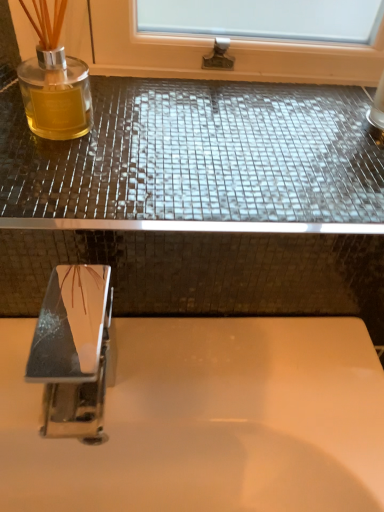
Locate an element on the screen. The image size is (384, 512). polished chrome tap at lower left is located at coordinates (73, 351).

This screenshot has height=512, width=384. What are the coordinates of `shiny mosaic tile counter top at upper center` in the screenshot? It's located at (199, 161).

At what (x,y) coordinates should I click in order to perform the action: click on white glossy sink at center. Please return your answer as a coordinate pair (x, y). The image size is (384, 512). Looking at the image, I should click on (187, 410).

Identify the location of polished chrome tap at lower left. Image resolution: width=384 pixels, height=512 pixels. (73, 351).

Which object is closer to the camera taking this photo, white glossy sink at center or polished chrome tap at lower left?

Positioned in front is polished chrome tap at lower left.

Can you confirm if white glossy sink at center is smaller than polished chrome tap at lower left?

No, white glossy sink at center is not smaller than polished chrome tap at lower left.

From a real-world perspective, is white glossy sink at center under polished chrome tap at lower left?

Yes, from a real-world perspective, white glossy sink at center is below polished chrome tap at lower left.

In the image, is white glossy sink at center on the left side or the right side of polished chrome tap at lower left?

white glossy sink at center is to the right of polished chrome tap at lower left.

Which is more to the left, shiny mosaic tile counter top at upper center or polished chrome tap at lower left?

polished chrome tap at lower left.

From a real-world perspective, between shiny mosaic tile counter top at upper center and polished chrome tap at lower left, who is vertically lower?

polished chrome tap at lower left is physically lower.

Is shiny mosaic tile counter top at upper center bigger than polished chrome tap at lower left?

Correct, shiny mosaic tile counter top at upper center is larger in size than polished chrome tap at lower left.

Looking at their sizes, would you say shiny mosaic tile counter top at upper center is wider or thinner than polished chrome tap at lower left?

Clearly, shiny mosaic tile counter top at upper center has more width compared to polished chrome tap at lower left.

Is white glossy sink at center positioned far away from shiny mosaic tile counter top at upper center?

No, white glossy sink at center is not far from shiny mosaic tile counter top at upper center.

Does white glossy sink at center have a lesser width compared to shiny mosaic tile counter top at upper center?

Yes, white glossy sink at center is thinner than shiny mosaic tile counter top at upper center.

From the image's perspective, is white glossy sink at center above shiny mosaic tile counter top at upper center?

No.

Does white glossy sink at center lie in front of shiny mosaic tile counter top at upper center?

Yes, the depth of white glossy sink at center is less than that of shiny mosaic tile counter top at upper center.

Which of these two, shiny mosaic tile counter top at upper center or white glossy sink at center, is wider?

Wider between the two is shiny mosaic tile counter top at upper center.

How distant is shiny mosaic tile counter top at upper center from white glossy sink at center?

A distance of 7.91 inches exists between shiny mosaic tile counter top at upper center and white glossy sink at center.

Which object is positioned more to the left, shiny mosaic tile counter top at upper center or white glossy sink at center?

white glossy sink at center.

Can you tell me how much shiny mosaic tile counter top at upper center and white glossy sink at center differ in facing direction?

0.127 degrees.

From the image's perspective, which one is positioned higher, polished chrome tap at lower left or shiny mosaic tile counter top at upper center?

shiny mosaic tile counter top at upper center appears higher in the image.

Which is more to the left, polished chrome tap at lower left or shiny mosaic tile counter top at upper center?

polished chrome tap at lower left is more to the left.

From the picture: Can you confirm if polished chrome tap at lower left is bigger than shiny mosaic tile counter top at upper center?

Incorrect, polished chrome tap at lower left is not larger than shiny mosaic tile counter top at upper center.

From a real-world perspective, is polished chrome tap at lower left positioned above or below shiny mosaic tile counter top at upper center?

Clearly, from a real-world perspective, polished chrome tap at lower left is below shiny mosaic tile counter top at upper center.

Is point (83, 379) closer to camera compared to point (94, 507)?

Yes, it is in front of point (94, 507).

How far apart are polished chrome tap at lower left and white glossy sink at center?

polished chrome tap at lower left and white glossy sink at center are 3.30 inches apart from each other.

Looking at this image, from a real-world perspective, is polished chrome tap at lower left above or below white glossy sink at center?

In terms of real-world spatial position, polished chrome tap at lower left is above white glossy sink at center.

Does polished chrome tap at lower left appear on the right side of white glossy sink at center?

No, polished chrome tap at lower left is not to the right of white glossy sink at center.

What are the coordinates of `sink behind the polished chrome tap at lower left` in the screenshot? It's located at (187, 410).

Identify the location of tap located underneath the shiny mosaic tile counter top at upper center (from a real-world perspective). This screenshot has height=512, width=384. (73, 351).

From the image, which object appears to be nearer to shiny mosaic tile counter top at upper center, polished chrome tap at lower left or white glossy sink at center?

Based on the image, white glossy sink at center appears to be nearer to shiny mosaic tile counter top at upper center.

Based on their spatial positions, is polished chrome tap at lower left or shiny mosaic tile counter top at upper center further from white glossy sink at center?

shiny mosaic tile counter top at upper center is further to white glossy sink at center.

Which object lies nearer to the anchor point polished chrome tap at lower left, white glossy sink at center or shiny mosaic tile counter top at upper center?

The object closer to polished chrome tap at lower left is white glossy sink at center.

From the picture: Based on their spatial positions, is shiny mosaic tile counter top at upper center or polished chrome tap at lower left closer to white glossy sink at center?

polished chrome tap at lower left is positioned closer to the anchor white glossy sink at center.

Which object lies nearer to the anchor point polished chrome tap at lower left, shiny mosaic tile counter top at upper center or white glossy sink at center?

Among the two, white glossy sink at center is located nearer to polished chrome tap at lower left.

Which object lies nearer to the anchor point shiny mosaic tile counter top at upper center, white glossy sink at center or polished chrome tap at lower left?

Among the two, white glossy sink at center is located nearer to shiny mosaic tile counter top at upper center.

Find the location of a particular element. tap between shiny mosaic tile counter top at upper center and white glossy sink at center vertically is located at coordinates (73, 351).